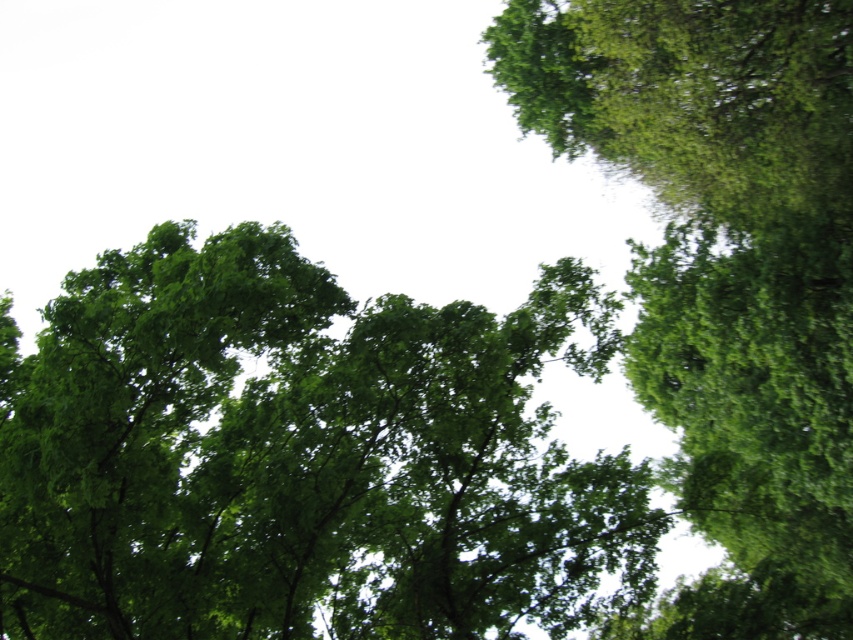
Question: Is the position of green leafy tree at center less distant than that of green leafy tree at upper right?

Choices:
 (A) no
 (B) yes

Answer: (B)

Question: Is green leafy tree at center above green leafy tree at upper right?

Choices:
 (A) no
 (B) yes

Answer: (A)

Question: Does green leafy tree at center have a smaller size compared to green leafy tree at upper right?

Choices:
 (A) no
 (B) yes

Answer: (B)

Question: Among these objects, which one is farthest from the camera?

Choices:
 (A) green leafy tree at upper right
 (B) green leafy tree at center

Answer: (A)